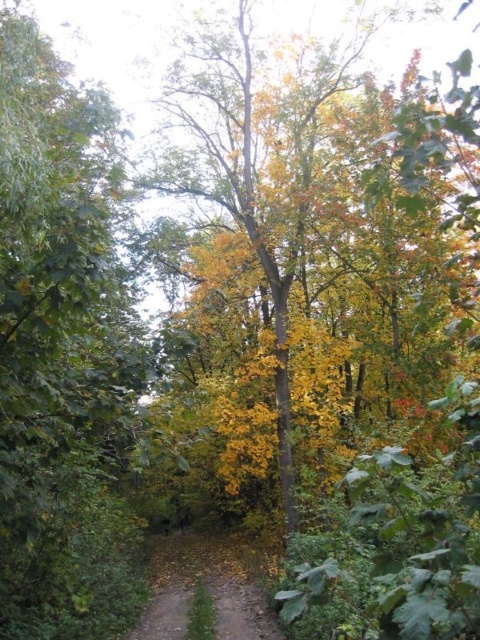
You are standing on the brown dirt path at center and want to walk towards the green leafy tree at left. Which direction should you head?

You should head to the left because the green leafy tree at left is to the left of the brown dirt path at center.